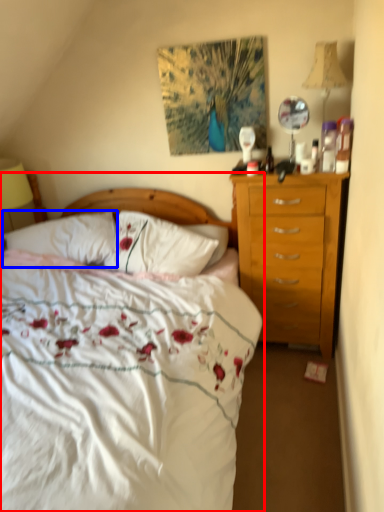
Question: Which object is closer to the camera taking this photo, bed (highlighted by a red box) or pillow (highlighted by a blue box)?

Choices:
 (A) bed
 (B) pillow

Answer: (A)